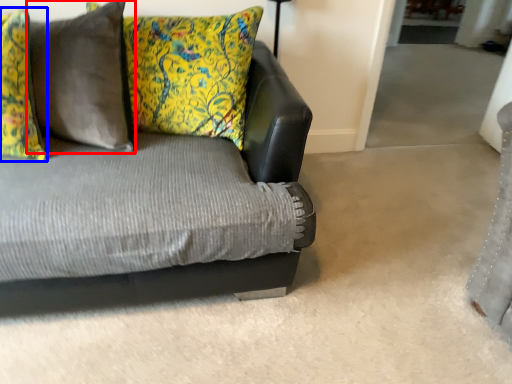
Question: Which object appears closest to the camera in this image, pillow (highlighted by a red box) or pillow (highlighted by a blue box)?

Choices:
 (A) pillow
 (B) pillow

Answer: (B)